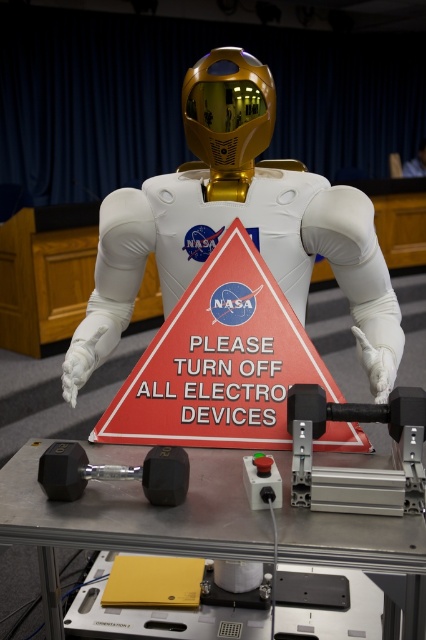
In the scene shown: Which is more to the right, metallic gray table at center or red plastic sign at center?

From the viewer's perspective, red plastic sign at center appears more on the right side.

Which of these two, metallic gray table at center or red plastic sign at center, stands shorter?

metallic gray table at center is shorter.

Locate an element on the screen. metallic gray table at center is located at coordinates (131, 518).

You are a GUI agent. You are given a task and a screenshot of the screen. Output one action in this format:
    pyautogui.click(x=<x>, y=<y>)
    Task: Click on the metallic gray table at center
    This screenshot has width=426, height=640.
    Given the screenshot: What is the action you would take?
    pyautogui.click(x=131, y=518)

Is white matte astronaut at center further to the viewer compared to red plastic sign at center?

Yes.

Which is above, white matte astronaut at center or red plastic sign at center?

Positioned higher is white matte astronaut at center.

Locate an element on the screen. The height and width of the screenshot is (640, 426). white matte astronaut at center is located at coordinates (232, 220).

Where is `white matte astronaut at center`? The height and width of the screenshot is (640, 426). white matte astronaut at center is located at coordinates (232, 220).

Which is below, white matte astronaut at center or metallic gray table at center?

metallic gray table at center

Can you confirm if white matte astronaut at center is positioned below metallic gray table at center?

Incorrect, white matte astronaut at center is not positioned below metallic gray table at center.

You are a GUI agent. You are given a task and a screenshot of the screen. Output one action in this format:
    pyautogui.click(x=<x>, y=<y>)
    Task: Click on the white matte astronaut at center
    This screenshot has width=426, height=640.
    Given the screenshot: What is the action you would take?
    pyautogui.click(x=232, y=220)